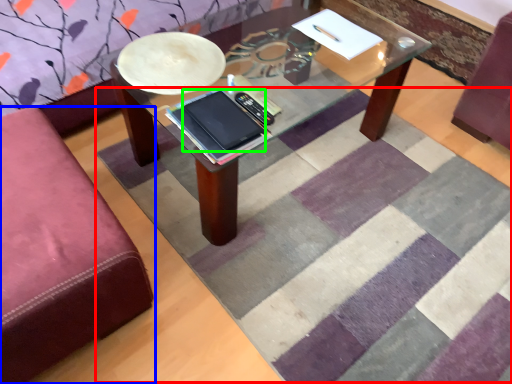
Question: Which object is positioned closest to mat (highlighted by a red box)? Select from studio couch (highlighted by a blue box) and tablet computer (highlighted by a green box).

Choices:
 (A) studio couch
 (B) tablet computer

Answer: (A)